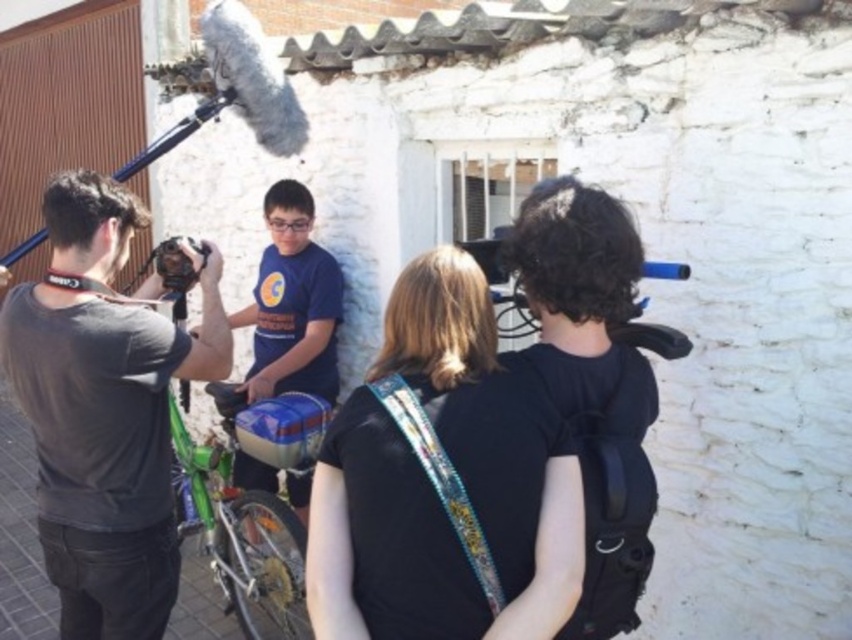
Who is positioned more to the left, green matte bicycle at center or matte black tripod at upper left?

Positioned to the left is matte black tripod at upper left.

Can you confirm if green matte bicycle at center is thinner than matte black tripod at upper left?

In fact, green matte bicycle at center might be wider than matte black tripod at upper left.

The height and width of the screenshot is (640, 852). Find the location of `green matte bicycle at center`. green matte bicycle at center is located at coordinates (240, 529).

Image resolution: width=852 pixels, height=640 pixels. In order to click on green matte bicycle at center in this screenshot , I will do `click(240, 529)`.

Between green matte bicycle at center and matte black camera at center, which one has more height?

With more height is green matte bicycle at center.

Does point (277, 561) come farther from viewer compared to point (193, 275)?

Yes, it is.

Locate an element on the screen. The image size is (852, 640). green matte bicycle at center is located at coordinates (240, 529).

Is point (514, 577) positioned behind point (283, 593)?

No, it is in front of (283, 593).

Can you confirm if black fabric backpack at center is positioned to the left of green matte bicycle at center?

Incorrect, black fabric backpack at center is not on the left side of green matte bicycle at center.

Who is more distant from viewer, (482, 490) or (229, 394)?

The point (229, 394) is behind.

Locate an element on the screen. This screenshot has height=640, width=852. black fabric backpack at center is located at coordinates (442, 483).